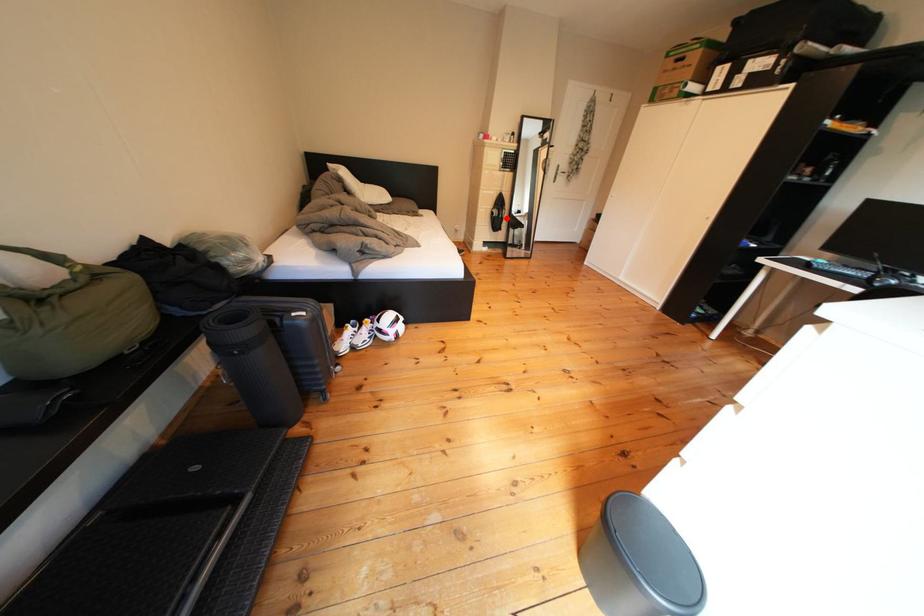
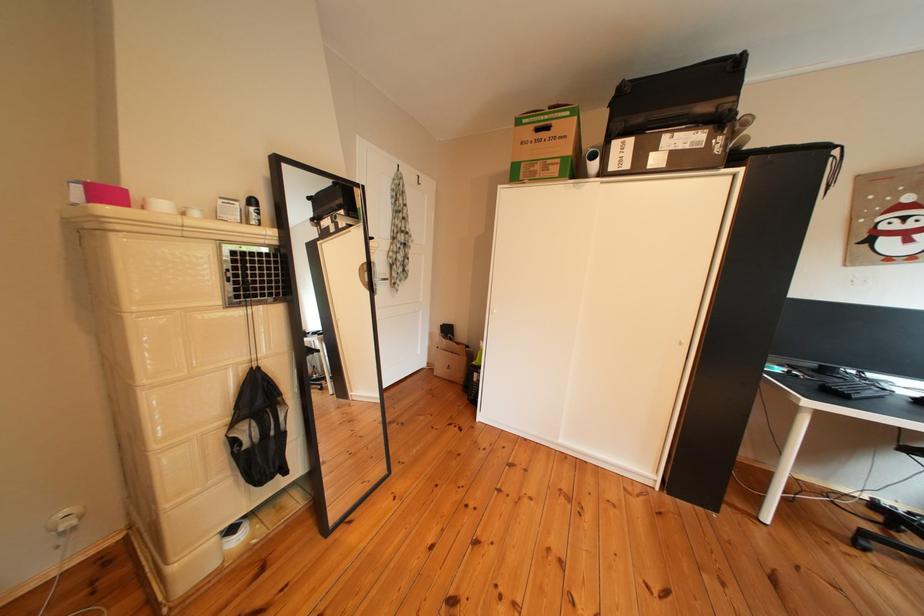
Find the pixel in the second image that matches the highlighted location in the first image.

(249, 447)